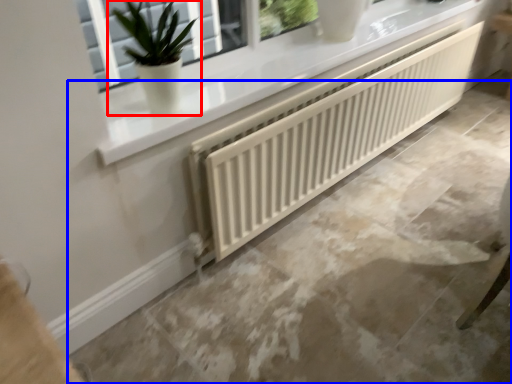
Question: Which object appears closest to the camera in this image, houseplant (highlighted by a red box) or concrete (highlighted by a blue box)?

Choices:
 (A) houseplant
 (B) concrete

Answer: (B)